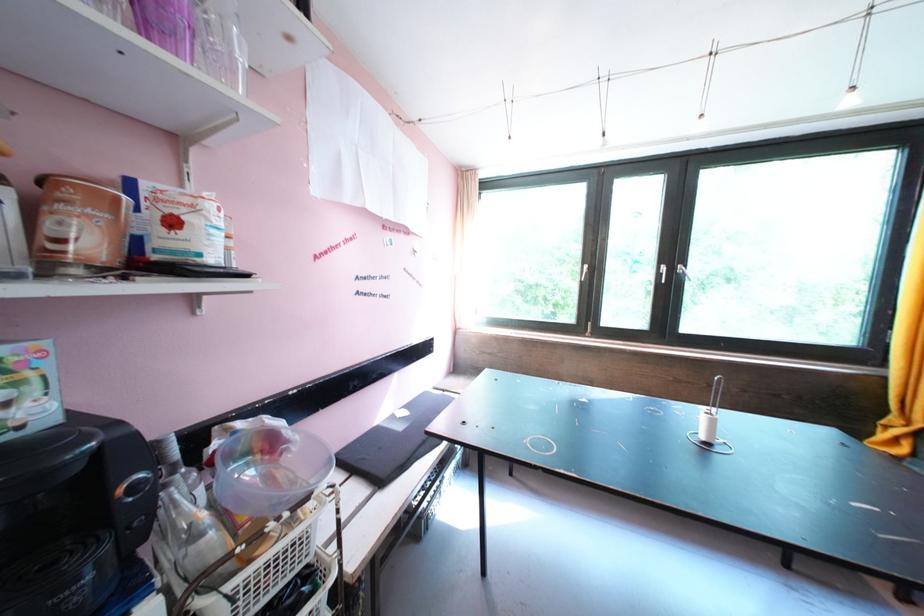
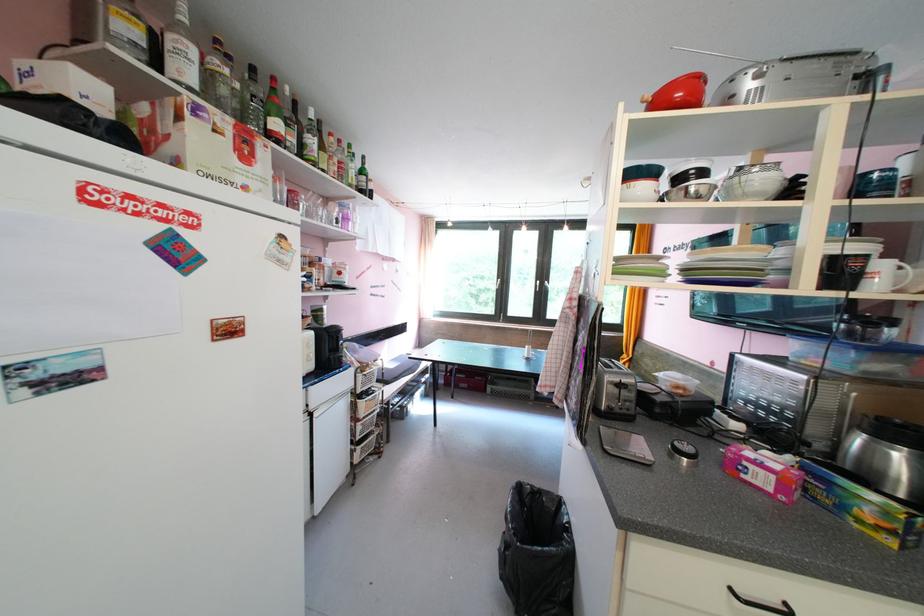
In the second image, find the point that corresponds to (x=661, y=265) in the first image.

(542, 282)